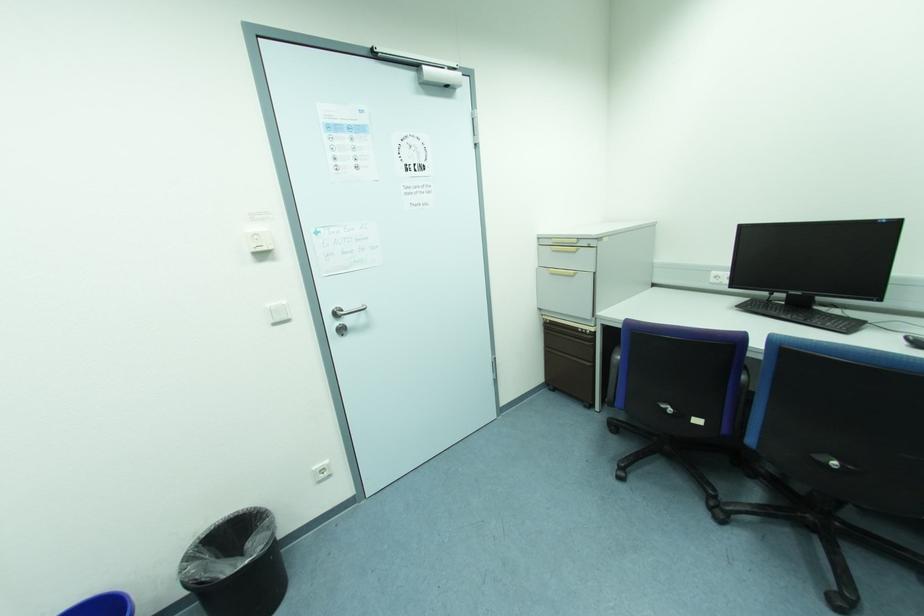
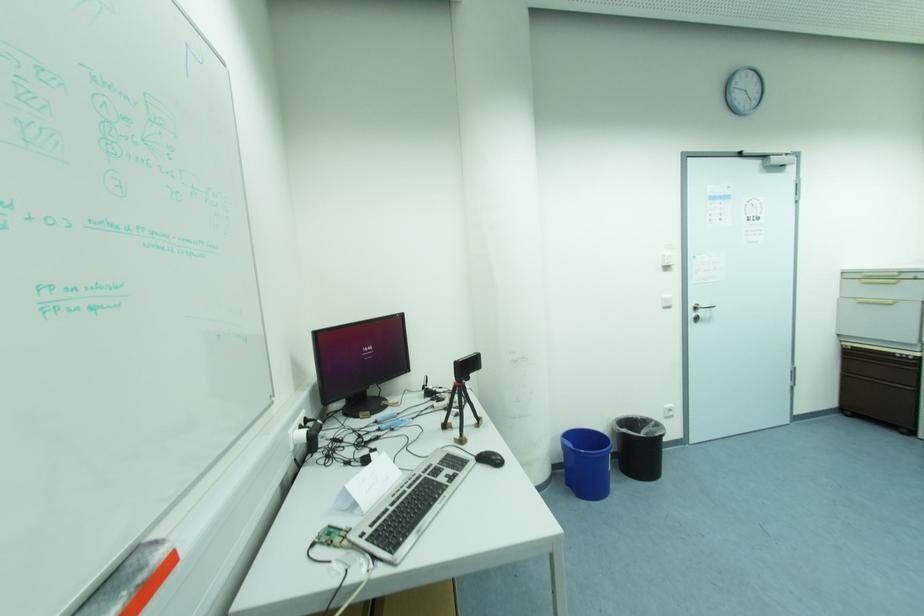
Where in the second image is the point corresponding to pixel 337 315 from the first image?

(697, 309)